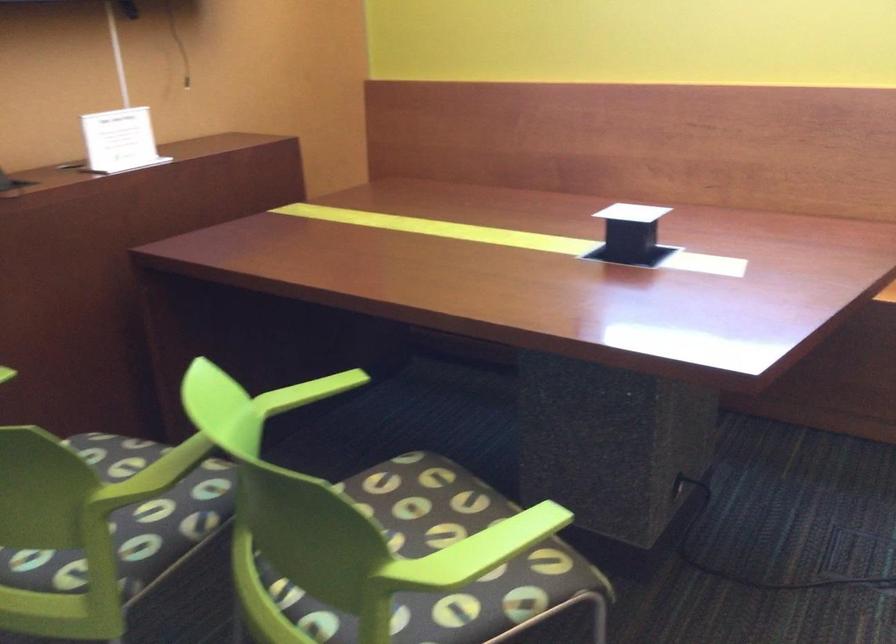
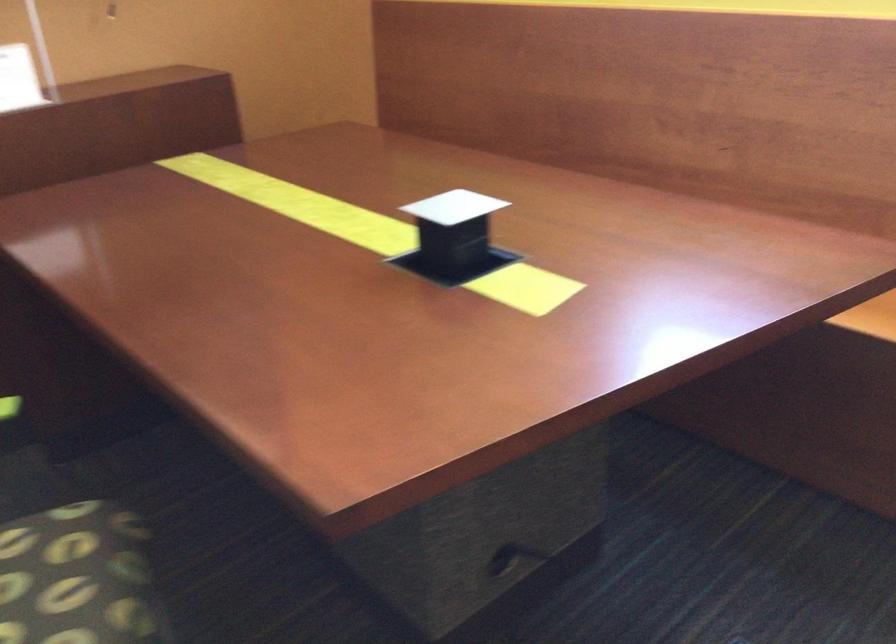
Find the pixel in the second image that matches point 633,212 in the first image.

(453, 207)